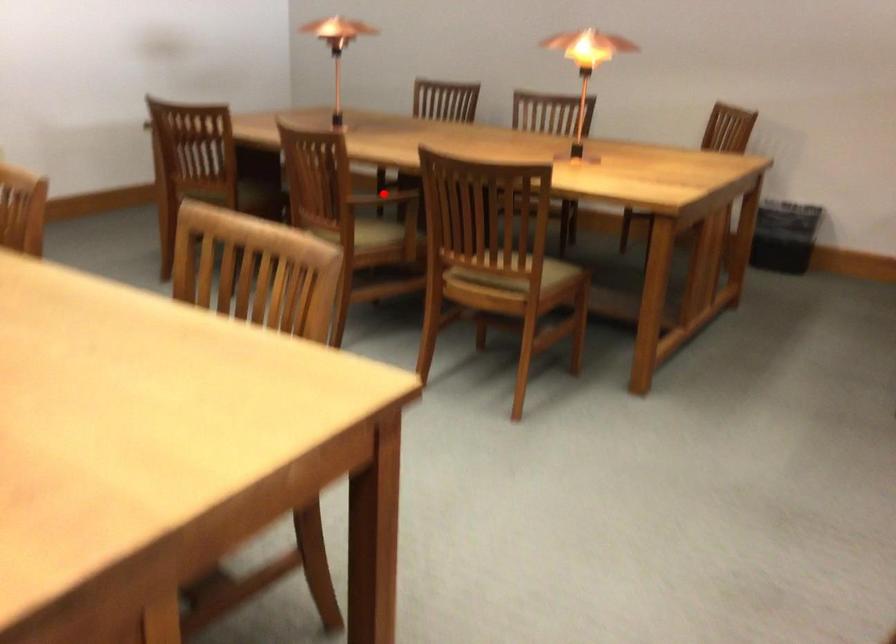
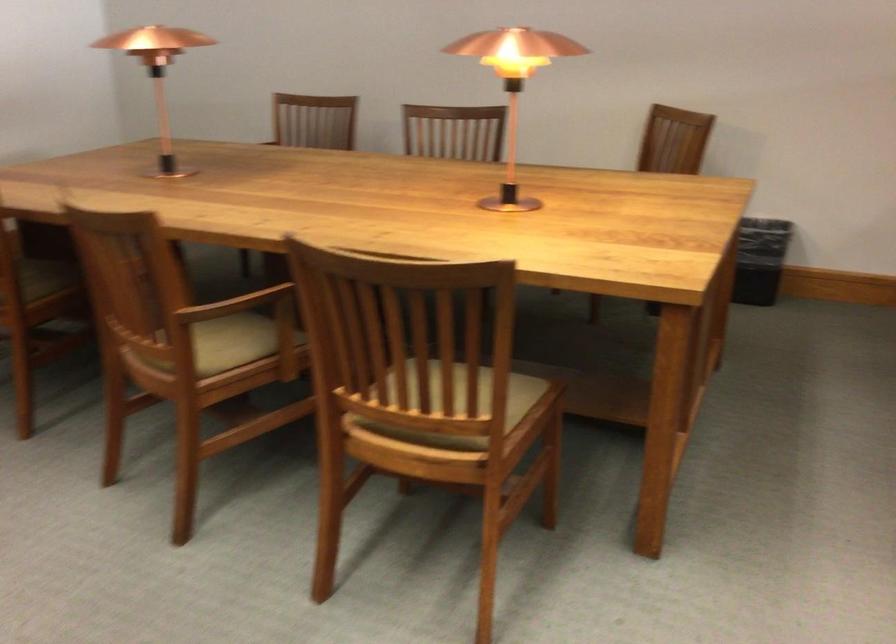
Question: A red point is marked in image1. In image2, is the corresponding 3D point closer to the camera or farther? Reply with the corresponding letter.

Choices:
 (A) The corresponding 3D point is closer.
 (B) The corresponding 3D point is farther.

Answer: (A)